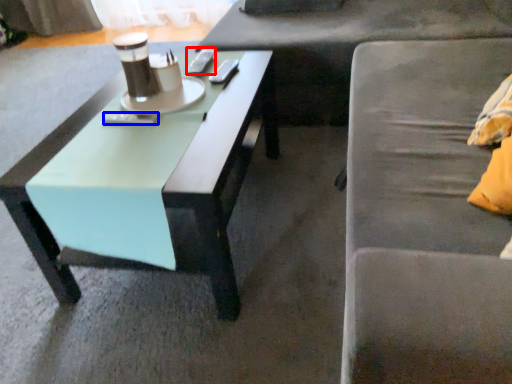
Question: Which of the following is the closest to the observer, remote control (highlighted by a red box) or remote control (highlighted by a blue box)?

Choices:
 (A) remote control
 (B) remote control

Answer: (B)